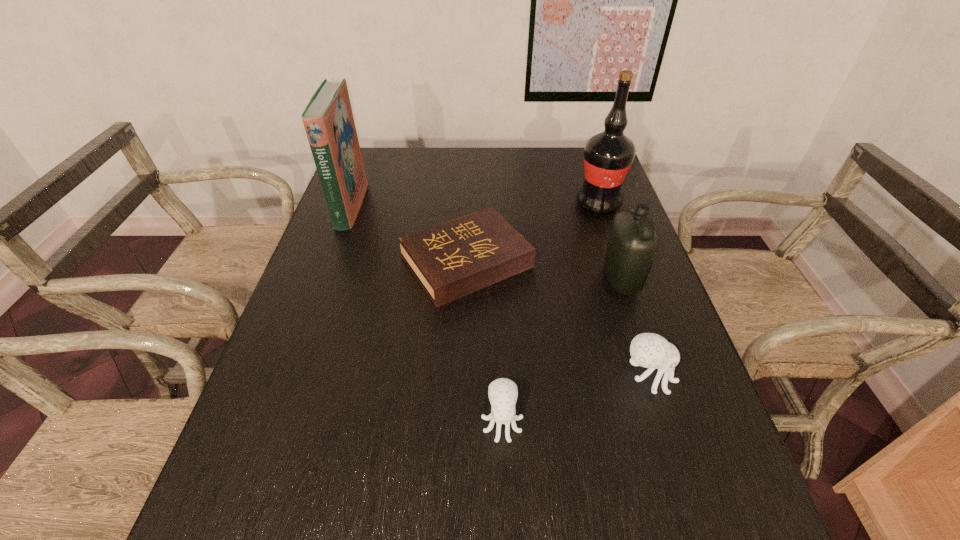
Locate an element on the screen. This screenshot has height=540, width=960. free location located 0.050m on the front-facing side of the left octopus is located at coordinates (504, 471).

Where is `free space located on the cover of the leftmost object`? free space located on the cover of the leftmost object is located at coordinates (391, 206).

Where is `vacant space located 0.140m on the back of the right hardback book`? vacant space located 0.140m on the back of the right hardback book is located at coordinates (468, 197).

Locate an element on the screen. The image size is (960, 540). vacant space located on the back of the wine bottle is located at coordinates 585,163.

Locate an element on the screen. The image size is (960, 540). vacant position located on the front of the bottle is located at coordinates (659, 395).

Find the location of a particular element. The image size is (960, 540). object at the near edge is located at coordinates (503, 392).

The image size is (960, 540). Find the location of `object that is at the left edge`. object that is at the left edge is located at coordinates click(x=328, y=119).

Identify the location of octopus located at the right edge. This screenshot has width=960, height=540. (649, 350).

Find the location of a particular element. Image resolution: width=960 pixels, height=540 pixels. wine bottle positioned at the right edge is located at coordinates (608, 156).

This screenshot has height=540, width=960. I want to click on bottle that is at the right edge, so click(633, 244).